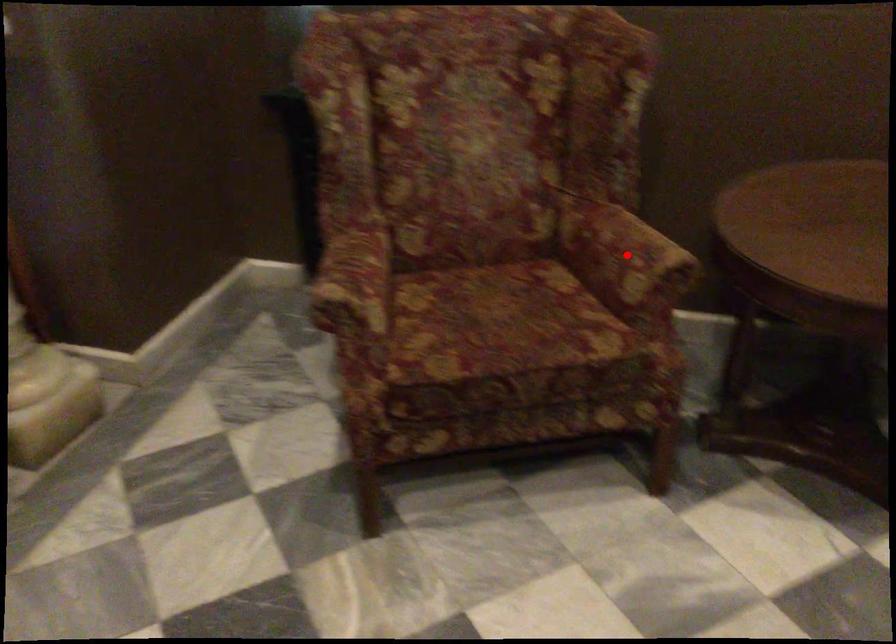
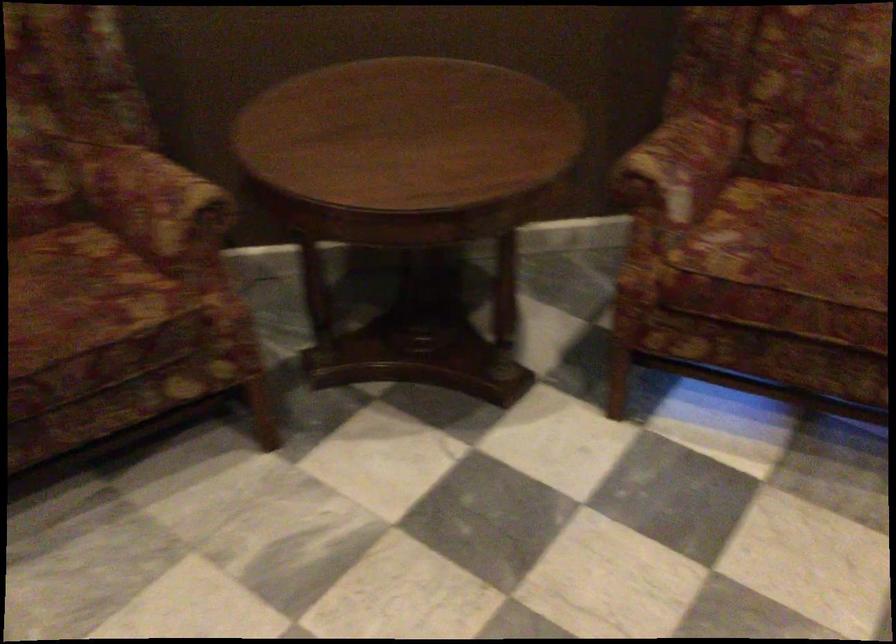
The point at the highlighted location is marked in the first image. Where is the corresponding point in the second image?

(156, 204)